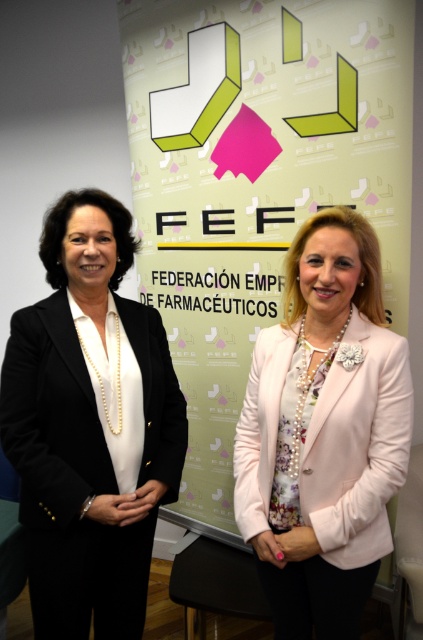
Is black matte blazer at left thinner than pink satin blazer at center?

No.

Does point (151, 400) come closer to viewer compared to point (345, 520)?

No, it is behind (345, 520).

This screenshot has height=640, width=423. What are the coordinates of `black matte blazer at left` in the screenshot? It's located at (90, 426).